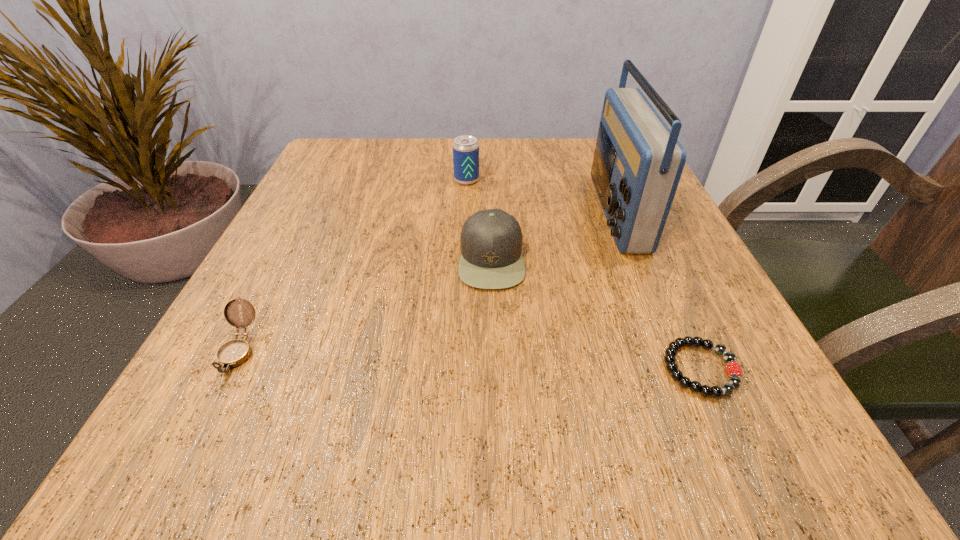
Where is `vacant area that lies between the second tallest object and the shortest object`? The width and height of the screenshot is (960, 540). vacant area that lies between the second tallest object and the shortest object is located at coordinates (584, 275).

Identify the location of vacant area that lies between the cap and the leftmost object. (365, 305).

The height and width of the screenshot is (540, 960). I want to click on vacant region between the leftmost object and the cap, so click(365, 305).

At what (x,y) coordinates should I click in order to perform the action: click on free area in between the tallest object and the cap. Please return your answer as a coordinate pair (x, y). Image resolution: width=960 pixels, height=540 pixels. Looking at the image, I should click on (553, 235).

Find the location of a particular element. vacant space that's between the radio receiver and the compass is located at coordinates (427, 281).

Where is `free space between the cap and the bracelet`? Image resolution: width=960 pixels, height=540 pixels. free space between the cap and the bracelet is located at coordinates (596, 314).

Find the location of a particular element. object that is the nearest to the fourth tallest object is located at coordinates (491, 240).

Choose which object is the nearest neighbor to the leftmost object. Please provide its 2D coordinates. Your answer should be formatted as a tuple, i.e. [(x, y)], where the tuple contains the x and y coordinates of a point satisfying the conditions above.

[(491, 240)]

This screenshot has height=540, width=960. Find the location of `free space that satisfies the following two spatial constraints: 1. on the front side of the beer can; 2. on the left side of the shortest object`. free space that satisfies the following two spatial constraints: 1. on the front side of the beer can; 2. on the left side of the shortest object is located at coordinates (458, 369).

This screenshot has width=960, height=540. I want to click on free location that satisfies the following two spatial constraints: 1. on the face of the leftmost object; 2. on the left side of the shortest object, so click(x=228, y=369).